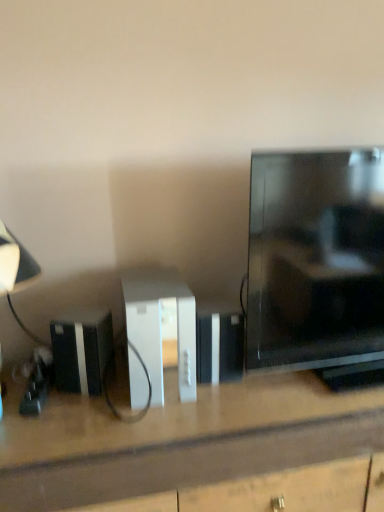
I want to click on blank space above white plastic console at center (from a real-world perspective), so click(148, 283).